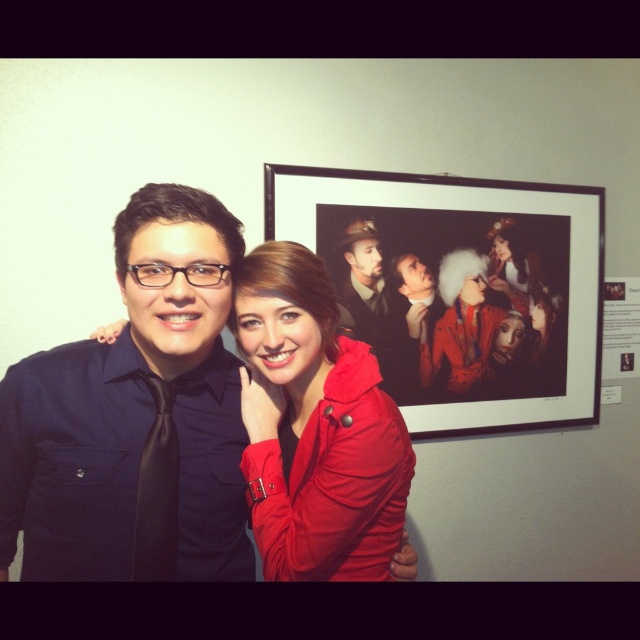
Between matte black shirt at left and white paper at upper right, which one is positioned lower?

matte black shirt at left is lower down.

The image size is (640, 640). Describe the element at coordinates (132, 413) in the screenshot. I see `matte black shirt at left` at that location.

Locate an element on the screen. The image size is (640, 640). matte black shirt at left is located at coordinates (132, 413).

Does matte black shirt at left come behind matte black suit at center?

No, matte black shirt at left is closer to the viewer.

Can you confirm if matte black shirt at left is taller than matte black suit at center?

Correct, matte black shirt at left is much taller as matte black suit at center.

Between point (56, 502) and point (348, 269), which one is positioned in front?

Point (56, 502) is in front.

This screenshot has width=640, height=640. Find the location of `matte black shirt at left`. matte black shirt at left is located at coordinates (132, 413).

At what (x,y) coordinates should I click in order to perform the action: click on matte black shirt at left. Please return your answer as a coordinate pair (x, y). Looking at the image, I should click on (132, 413).

Is matte black shirt at left bigger than matte red coat at center?

Yes, matte black shirt at left is bigger than matte red coat at center.

In the scene shown: Measure the distance between matte black shirt at left and camera.

matte black shirt at left is 33.62 inches away from camera.

Find the location of a particular element. matte black shirt at left is located at coordinates (132, 413).